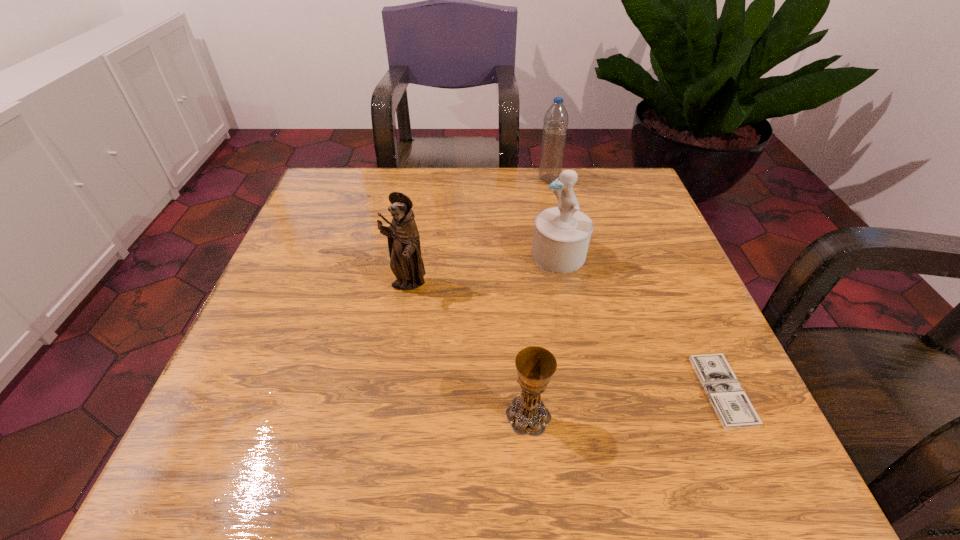
What are the coordinates of `the farthest object` in the screenshot? It's located at (555, 126).

Find the location of a particular element. Image resolution: width=960 pixels, height=540 pixels. the right figurine is located at coordinates (562, 233).

What are the coordinates of `the leftmost object` in the screenshot? It's located at (406, 263).

This screenshot has height=540, width=960. Identify the location of the fourth object from right to left. (527, 414).

Identify the location of the second shortest object. The height and width of the screenshot is (540, 960). [x=527, y=414].

The height and width of the screenshot is (540, 960). I want to click on dollar, so click(x=734, y=409).

Locate an element on the screen. This screenshot has height=540, width=960. the rightmost object is located at coordinates (734, 409).

The height and width of the screenshot is (540, 960). What are the coordinates of `vacant space situated on the front of the water bottle` in the screenshot? It's located at [572, 290].

Where is `vacant region located at the beak of the right figurine`? vacant region located at the beak of the right figurine is located at coordinates (452, 255).

You are a GUI agent. You are given a task and a screenshot of the screen. Output one action in this format:
    pyautogui.click(x=<x>, y=<y>)
    Task: Click on the free space located at the beak of the right figurine
    
    Given the screenshot: What is the action you would take?
    pyautogui.click(x=438, y=255)